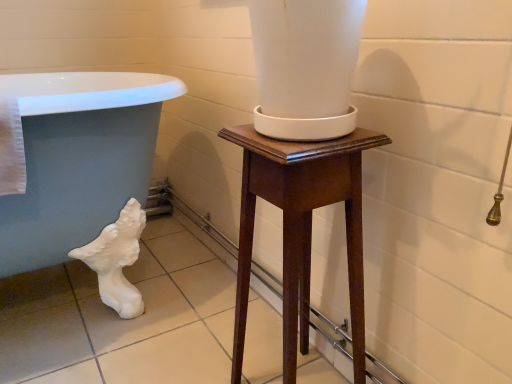
Where is `blank area beneath white glossy bath at lower left (from a real-world perspective)`? blank area beneath white glossy bath at lower left (from a real-world perspective) is located at coordinates (94, 302).